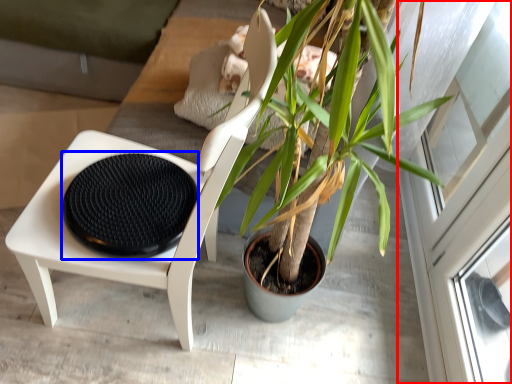
Question: Among these objects, which one is nearest to the camera, screen door (highlighted by a red box) or footrest (highlighted by a blue box)?

Choices:
 (A) screen door
 (B) footrest

Answer: (B)